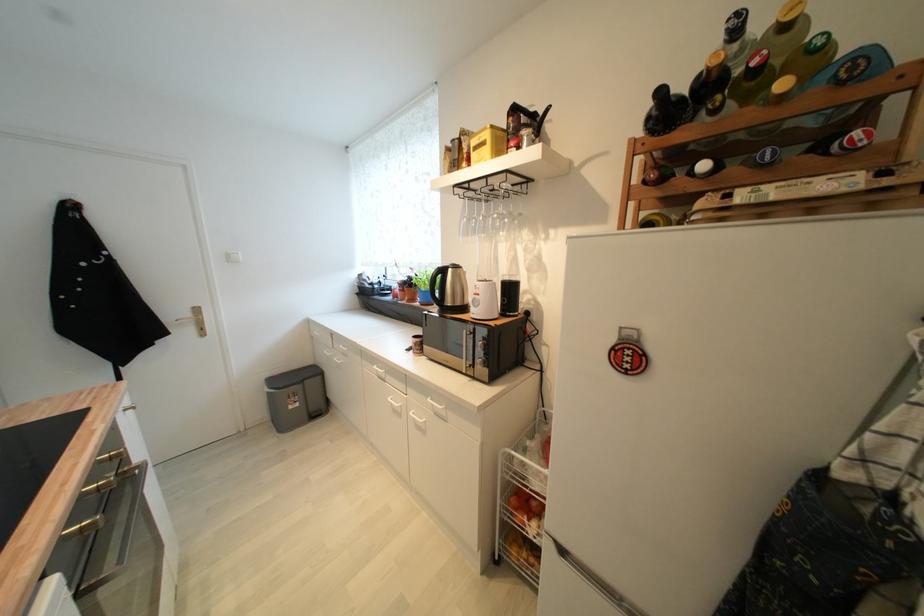
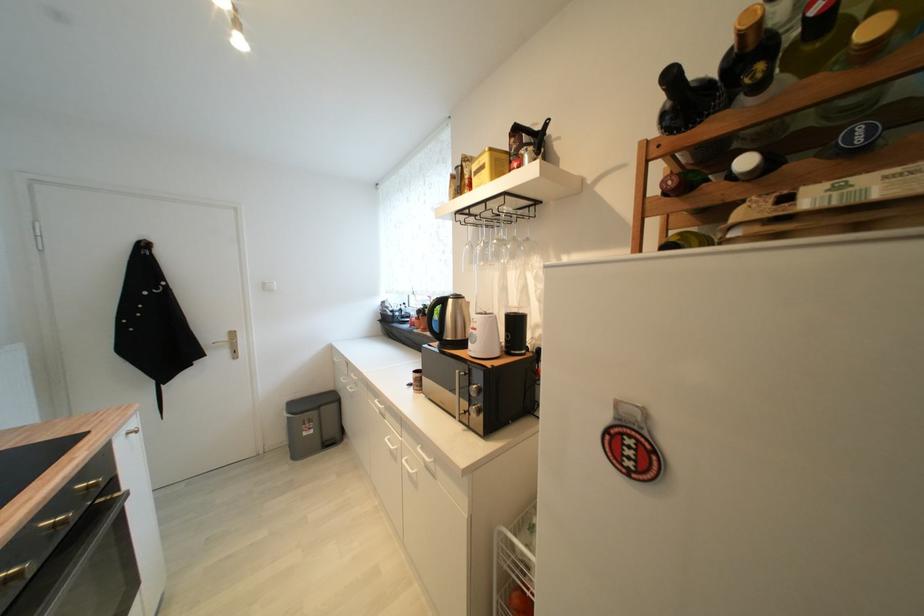
The point at [483,296] is marked in the first image. Where is the corresponding point in the second image?

(480, 331)